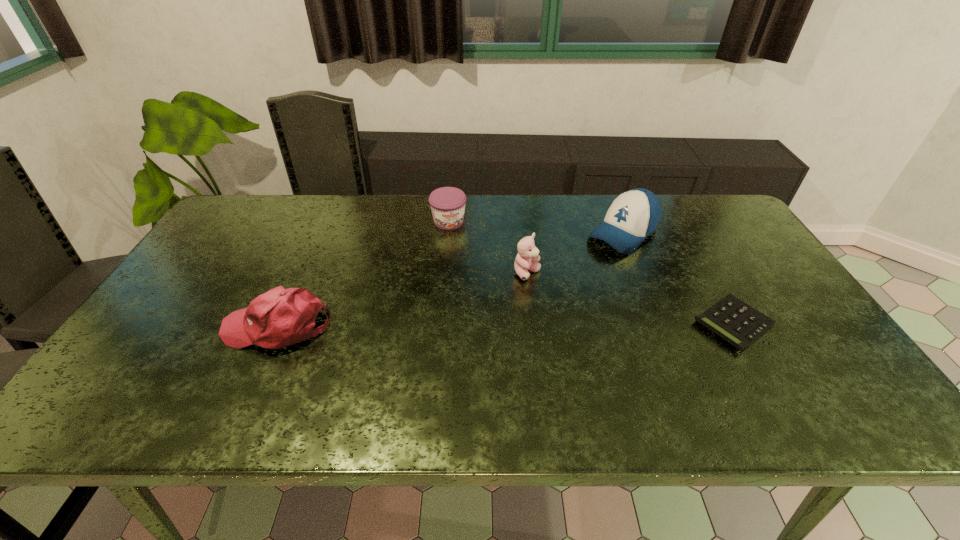
Locate an element on the screen. This screenshot has width=960, height=540. free space at the far right corner of the desktop is located at coordinates [x=719, y=235].

What are the coordinates of `free space between the calculator and the right baseball cap` in the screenshot? It's located at (678, 278).

The width and height of the screenshot is (960, 540). In order to click on free spot between the nearer baseball cap and the third nearest object in this screenshot , I will do `click(402, 300)`.

Find the location of a particular element. free area in between the nearer baseball cap and the shortest object is located at coordinates (505, 325).

At what (x,y) coordinates should I click in order to perform the action: click on free spot between the right baseball cap and the calculator. Please return your answer as a coordinate pair (x, y). This screenshot has height=540, width=960. Looking at the image, I should click on (678, 278).

At what (x,y) coordinates should I click in order to perform the action: click on vacant space that's between the third object from left to right and the left baseball cap. Please return your answer as a coordinate pair (x, y). Looking at the image, I should click on (402, 300).

Image resolution: width=960 pixels, height=540 pixels. What are the coordinates of `vacant point located between the nearer baseball cap and the third object from right to left` in the screenshot? It's located at (402, 300).

The image size is (960, 540). Find the location of `free space between the left baseball cap and the calculator`. free space between the left baseball cap and the calculator is located at coordinates (505, 325).

Locate an element on the screen. unoccupied position between the shortest object and the leftmost object is located at coordinates [505, 325].

The height and width of the screenshot is (540, 960). In order to click on free space between the left baseball cap and the third nearest object in this screenshot , I will do click(402, 300).